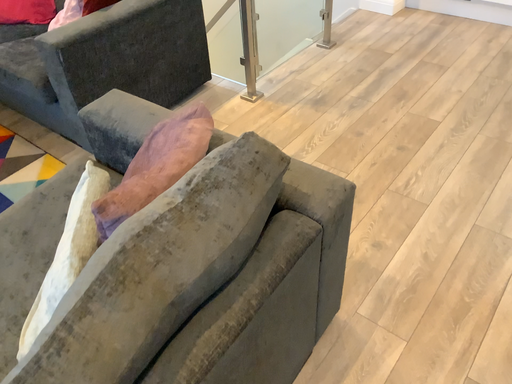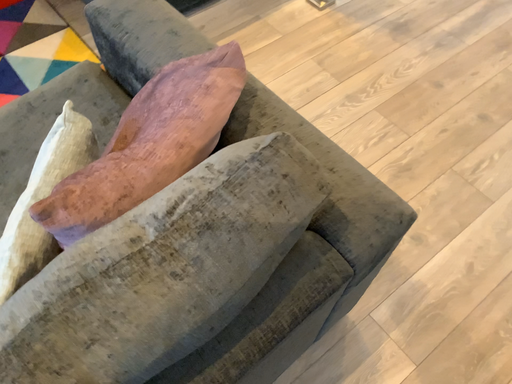
Question: Which way did the camera rotate in the video?

Choices:
 (A) rotated downward
 (B) rotated upward

Answer: (A)